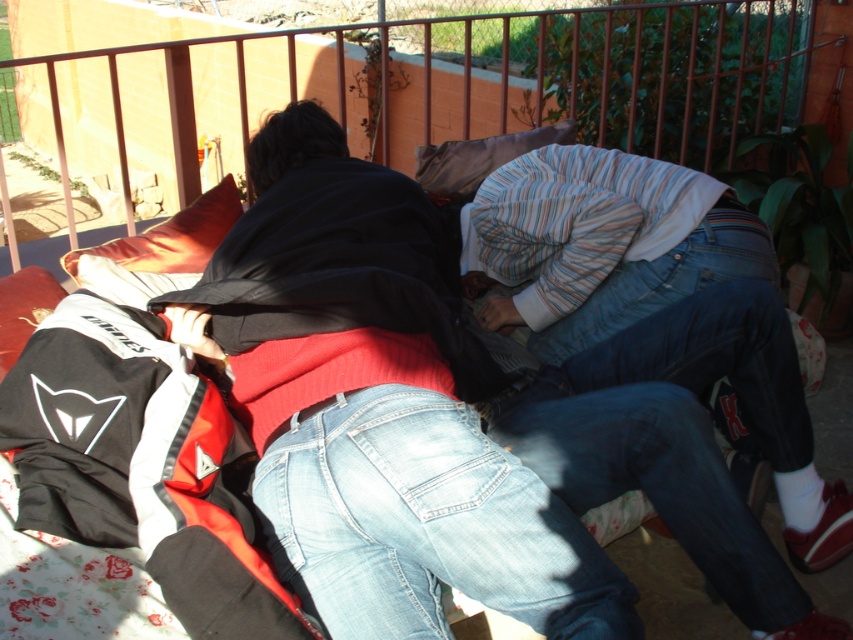
In the scene shown: You are a photographer trying to capture a closeup of the light blue denim jeans at center and the orange fabric pillow at upper left in the same frame. The camera you are using has a maximum focus range of 35 inches. Can you fit both objects in focus without moving the camera?

The light blue denim jeans at center and orange fabric pillow at upper left are 34.84 inches apart from each other. Since the distance between them is within the camera maximum focus range of 35 inches, you can fit both objects in focus without moving the camera.

You are standing in front of the balcony and want to place a small potted plant between the two points marked as point (532, 592) and point (225, 202). Which point should the plant be closer to in order to be nearer to the camera?

The plant should be placed closer to point (532, 592) because it is closer to the camera than point (225, 202).

Based on the photo, you are a delivery person trying to place a small package between the orange fabric pillow at upper left and the striped fabric pillow at center. Can you fit it there?

The distance between the orange fabric pillow at upper left and the striped fabric pillow at center is 26.45 inches, so the small package can fit there as the space is sufficient.